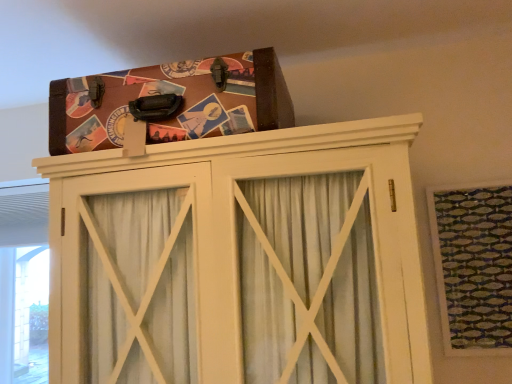
Question: Considering the relative sizes of green textured fabric at upper right and wooden cabinet at upper center in the image provided, is green textured fabric at upper right shorter than wooden cabinet at upper center?

Choices:
 (A) no
 (B) yes

Answer: (B)

Question: Does green textured fabric at upper right have a larger size compared to wooden cabinet at upper center?

Choices:
 (A) yes
 (B) no

Answer: (B)

Question: From a real-world perspective, is green textured fabric at upper right physically above wooden cabinet at upper center?

Choices:
 (A) no
 (B) yes

Answer: (A)

Question: Does green textured fabric at upper right have a lesser width compared to wooden cabinet at upper center?

Choices:
 (A) no
 (B) yes

Answer: (B)

Question: Is the surface of green textured fabric at upper right in direct contact with wooden cabinet at upper center?

Choices:
 (A) no
 (B) yes

Answer: (A)

Question: Looking at the image, does wooden cabinet at upper center seem bigger or smaller compared to green textured fabric at upper right?

Choices:
 (A) big
 (B) small

Answer: (A)

Question: In terms of width, does wooden cabinet at upper center look wider or thinner when compared to green textured fabric at upper right?

Choices:
 (A) thin
 (B) wide

Answer: (B)

Question: Is wooden cabinet at upper center in front of or behind green textured fabric at upper right in the image?

Choices:
 (A) front
 (B) behind

Answer: (A)

Question: Is wooden cabinet at upper center inside the boundaries of green textured fabric at upper right, or outside?

Choices:
 (A) inside
 (B) outside

Answer: (B)

Question: From a real-world perspective, relative to wooden cabinet at upper center, is green textured fabric at upper right vertically above or below?

Choices:
 (A) above
 (B) below

Answer: (B)

Question: Is green textured fabric at upper right wider or thinner than wooden cabinet at upper center?

Choices:
 (A) thin
 (B) wide

Answer: (A)

Question: Is green textured fabric at upper right to the left or to the right of wooden cabinet at upper center in the image?

Choices:
 (A) right
 (B) left

Answer: (A)

Question: From the image's perspective, is green textured fabric at upper right above or below wooden cabinet at upper center?

Choices:
 (A) above
 (B) below

Answer: (A)

Question: Based on their sizes in the image, would you say green textured fabric at upper right is bigger or smaller than brown leather suitcase at upper center?

Choices:
 (A) small
 (B) big

Answer: (A)

Question: Is green textured fabric at upper right to the left or to the right of brown leather suitcase at upper center in the image?

Choices:
 (A) left
 (B) right

Answer: (B)